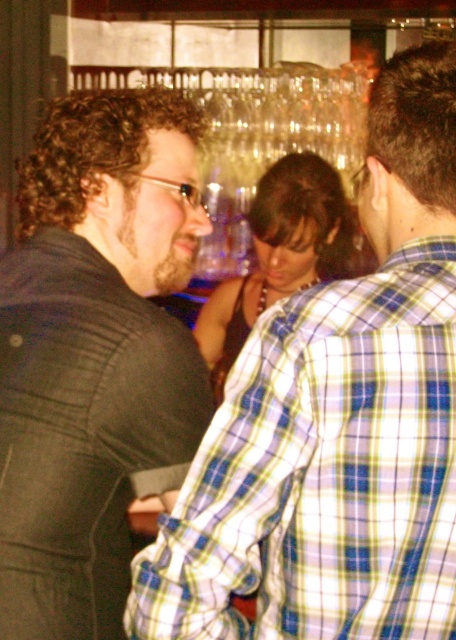
You are standing at the point labeled point (119, 220) and want to see the person at point (228, 484). Can you see them clearly from your current position?

Yes, because point (228, 484) is in front of point (119, 220), so the person at point (228, 484) is visible from your current position.

You are a photographer at this event and want to capture a photo of both the blue plaid shirt at center and the matte black dress at center without any overlap. Given their widths, which one should you position closer to the camera to ensure both fit in the frame?

The blue plaid shirt at center has a lesser width compared to the matte black dress at center. To fit both in the frame without overlap, position the narrower blue plaid shirt at center closer to the camera and the wider matte black dress at center further back.

Consider the image. You are a photographer at the event and want to take a photo of both the blue plaid shirt at center and the matte black dress at center without any obstructions. Given that your camera has a maximum focus range of 5 feet, will you be able to capture both subjects clearly in the same frame?

The blue plaid shirt at center and matte black dress at center are 5.13 feet apart, which exceeds the camera maximum focus range of 5 feet. Therefore, you cannot capture both subjects clearly in the same frame.